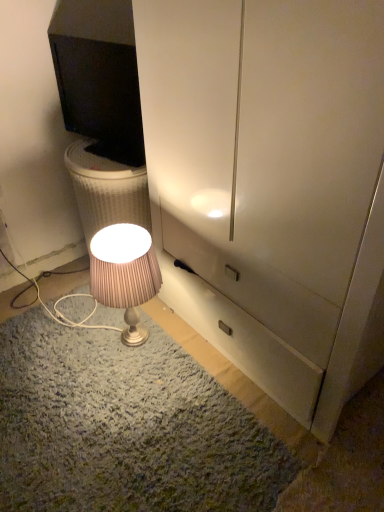
Question: Is black glossy monitor at upper left behind matte silver lamp at lower center?

Choices:
 (A) no
 (B) yes

Answer: (B)

Question: Is black glossy monitor at upper left not near matte silver lamp at lower center?

Choices:
 (A) yes
 (B) no

Answer: (B)

Question: Can you see black glossy monitor at upper left touching matte silver lamp at lower center?

Choices:
 (A) yes
 (B) no

Answer: (B)

Question: From the image's perspective, is black glossy monitor at upper left located above matte silver lamp at lower center?

Choices:
 (A) no
 (B) yes

Answer: (B)

Question: Considering the relative positions of black glossy monitor at upper left and matte silver lamp at lower center in the image provided, is black glossy monitor at upper left to the left of matte silver lamp at lower center from the viewer's perspective?

Choices:
 (A) no
 (B) yes

Answer: (B)

Question: Can you confirm if black glossy monitor at upper left is smaller than matte silver lamp at lower center?

Choices:
 (A) yes
 (B) no

Answer: (A)

Question: From the image's perspective, is matte silver lamp at lower center located beneath black glossy monitor at upper left?

Choices:
 (A) no
 (B) yes

Answer: (B)

Question: Is black glossy monitor at upper left completely or partially inside matte silver lamp at lower center?

Choices:
 (A) no
 (B) yes

Answer: (A)

Question: Is matte silver lamp at lower center shorter than black glossy monitor at upper left?

Choices:
 (A) yes
 (B) no

Answer: (B)

Question: Is matte silver lamp at lower center with black glossy monitor at upper left?

Choices:
 (A) yes
 (B) no

Answer: (B)

Question: Is the position of matte silver lamp at lower center more distant than that of black glossy monitor at upper left?

Choices:
 (A) no
 (B) yes

Answer: (A)

Question: Is matte silver lamp at lower center facing towards black glossy monitor at upper left?

Choices:
 (A) yes
 (B) no

Answer: (B)

Question: Choose the correct answer: Is matte silver lamp at lower center inside black glossy monitor at upper left or outside it?

Choices:
 (A) inside
 (B) outside

Answer: (B)